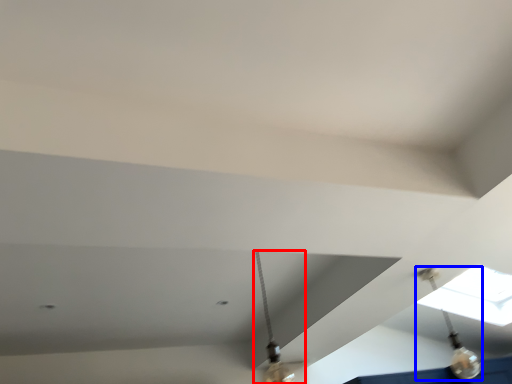
Question: Which object is closer to the camera taking this photo, lamp (highlighted by a red box) or light fixture (highlighted by a blue box)?

Choices:
 (A) lamp
 (B) light fixture

Answer: (A)